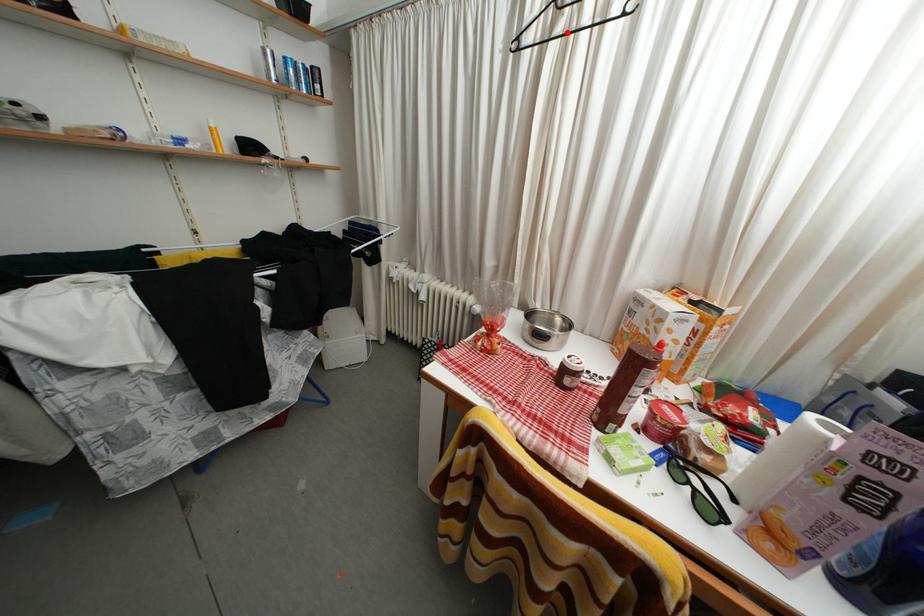
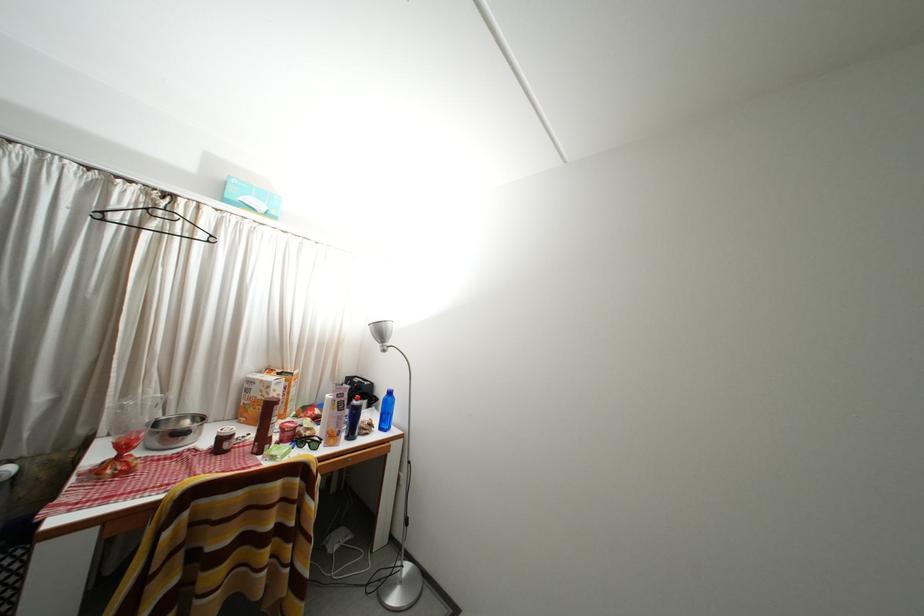
In the second image, find the point that corresponds to the highlighted location in the first image.

(161, 230)